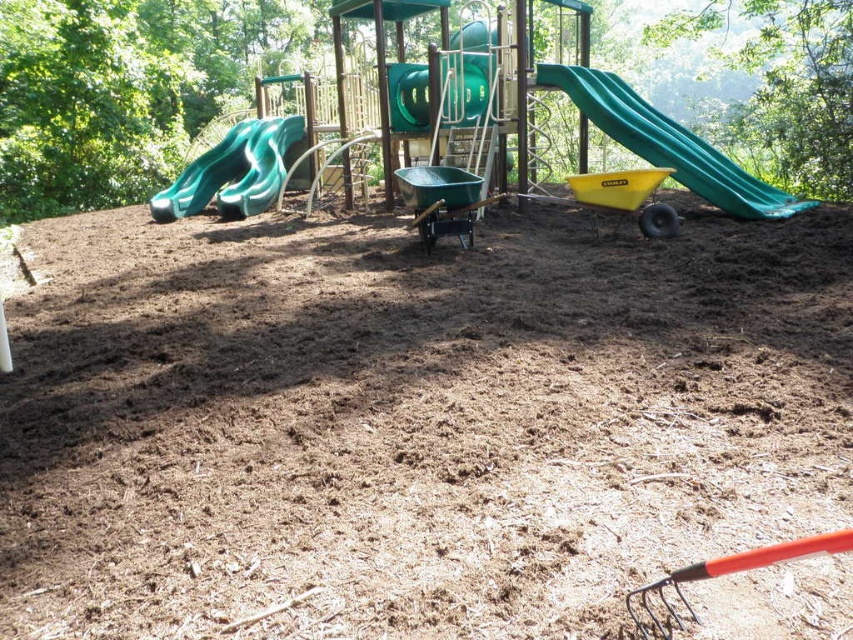
Question: Which object appears farthest from the camera in this image?

Choices:
 (A) green rubber slide at left
 (B) green plastic slide at right

Answer: (A)

Question: Based on their relative distances, which object is nearer to the brown mulch at center?

Choices:
 (A) green plastic slide at right
 (B) green rubber slide at left

Answer: (A)

Question: Does green plastic slide at right have a lesser width compared to green rubber slide at left?

Choices:
 (A) no
 (B) yes

Answer: (A)

Question: Does green plastic slide at right lie in front of green rubber slide at left?

Choices:
 (A) yes
 (B) no

Answer: (A)

Question: Which object appears closest to the camera in this image?

Choices:
 (A) green plastic slide at right
 (B) green rubber slide at left
 (C) brown mulch at center

Answer: (C)

Question: Is green plastic slide at right bigger than green rubber slide at left?

Choices:
 (A) no
 (B) yes

Answer: (B)